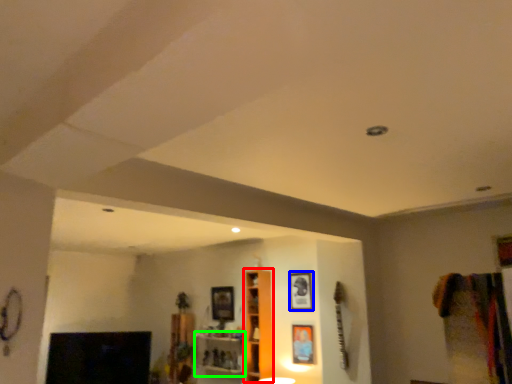
Question: Which is farther away from cabinet (highlighted by a red box)? picture frame (highlighted by a blue box) or shelf (highlighted by a green box)?

Choices:
 (A) picture frame
 (B) shelf

Answer: (B)